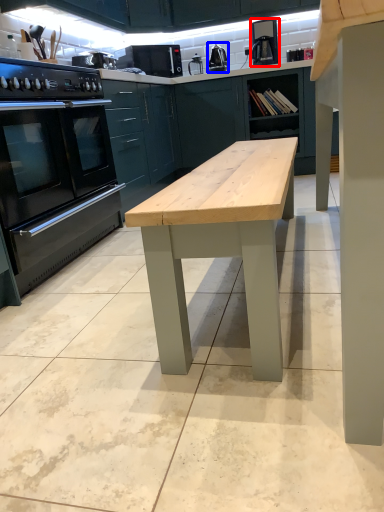
Question: Which of the following is the closest to the observer, coffee machine (highlighted by a red box) or appliance (highlighted by a blue box)?

Choices:
 (A) coffee machine
 (B) appliance

Answer: (A)